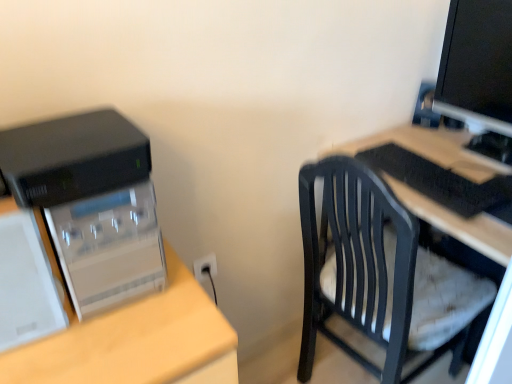
Where is `free region under black plastic keyboard at right (from a real-world perspective)`? free region under black plastic keyboard at right (from a real-world perspective) is located at coordinates (424, 187).